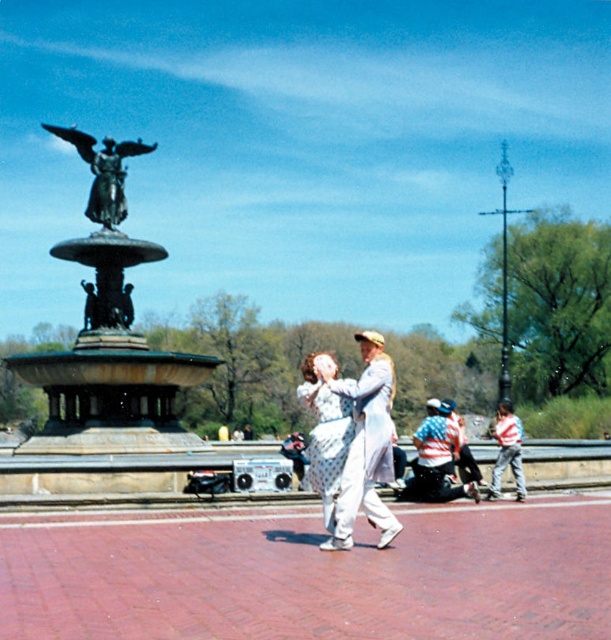
You are a photographer planning to take a portrait of the two people in the scene. The white dotted dress at center and the striped shirt at lower right are both in focus. Which one would you adjust your camera settings to prioritize focusing on, considering their sizes?

The white dotted dress at center is thinner than the striped shirt at lower right, so you should prioritize focusing on the striped shirt at lower right because it has a larger size and might be easier to capture clearly.

You are a photographer planning to take a photo of the bronze statue at center and the bronze statue at upper left. If you want to ensure both statues are fully visible in your frame, which statue should you focus on first to avoid cropping?

The bronze statue at center is much taller than the bronze statue at upper left, so you should focus on the bronze statue at center first to ensure it fits within the frame without being cropped, then adjust to include the smaller bronze statue at upper left.